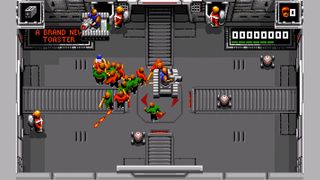
Image resolution: width=320 pixels, height=180 pixels. I want to click on floor, so click(63, 113), click(217, 70).